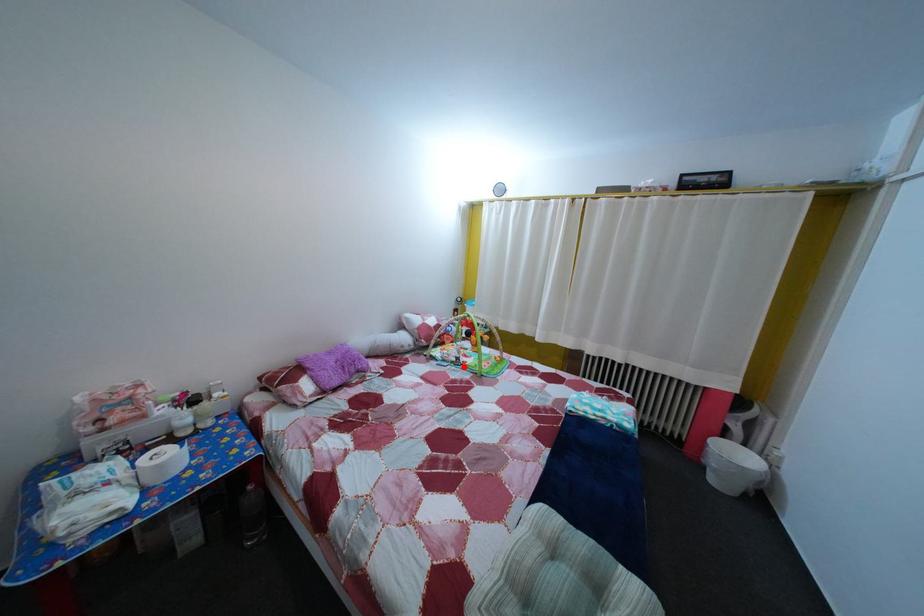
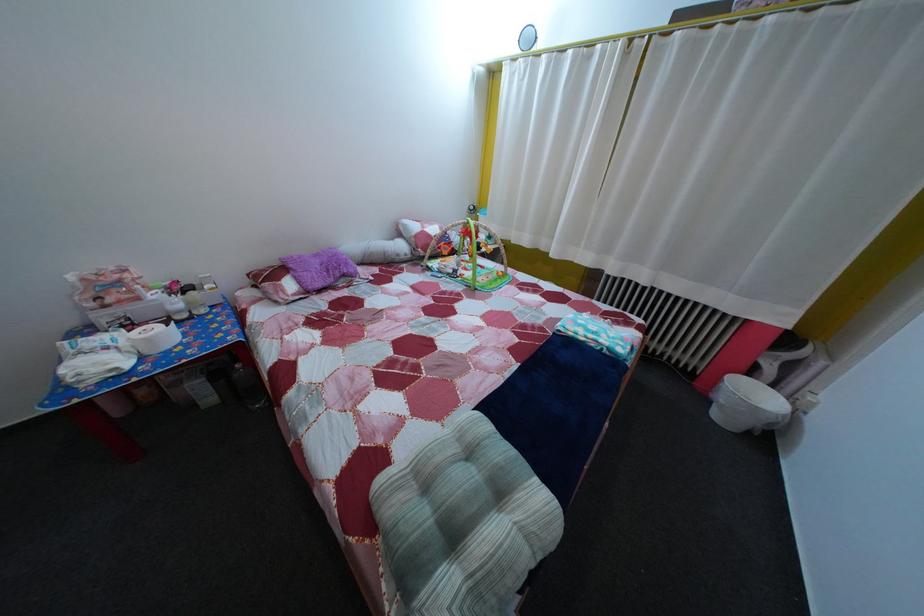
Where in the second image is the point corresponding to the highlighted location from the first image?

(459, 278)